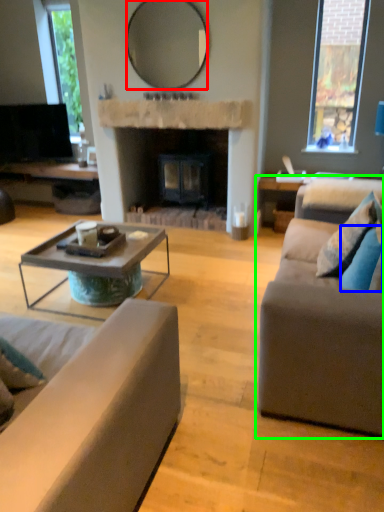
Question: Considering the real-world distances, which object is closest to mirror (highlighted by a red box)? pillow (highlighted by a blue box) or studio couch (highlighted by a green box).

Choices:
 (A) pillow
 (B) studio couch

Answer: (A)